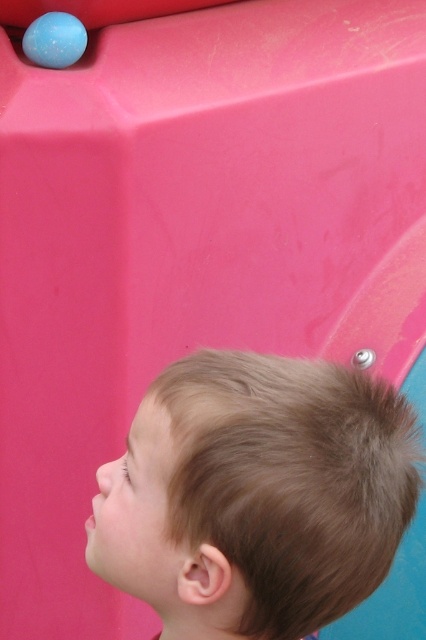
Can you confirm if brown hair at upper right is bigger than matte blue ball at upper left?

Correct, brown hair at upper right is larger in size than matte blue ball at upper left.

Looking at this image, between brown hair at upper right and matte blue ball at upper left, which one has less height?

matte blue ball at upper left is shorter.

What do you see at coordinates (256, 496) in the screenshot? This screenshot has width=426, height=640. I see `brown hair at upper right` at bounding box center [256, 496].

Locate an element on the screen. Image resolution: width=426 pixels, height=640 pixels. brown hair at upper right is located at coordinates (256, 496).